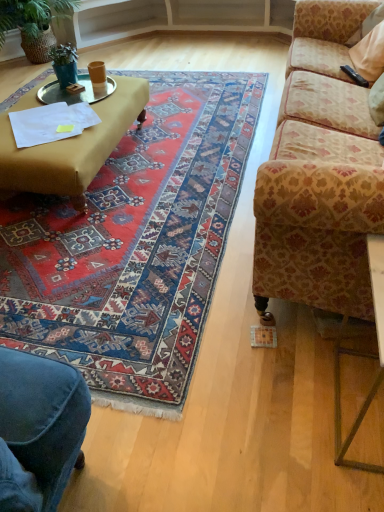
Where is `free spot to the right of matte yellow ottoman at left`? This screenshot has width=384, height=512. free spot to the right of matte yellow ottoman at left is located at coordinates 180,157.